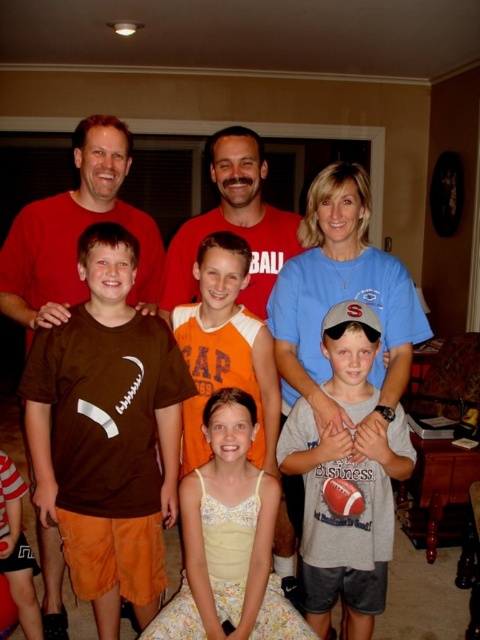
Who is taller, brown cotton t-shirt at center or yellow lace dress at center?

brown cotton t-shirt at center

Where is `brown cotton t-shirt at center`? brown cotton t-shirt at center is located at coordinates (108, 433).

Can you confirm if brown cotton t-shirt at center is taller than brown matte jersey at center?

Indeed, brown cotton t-shirt at center has a greater height compared to brown matte jersey at center.

Which is behind, point (103, 401) or point (144, 253)?

The point (144, 253) is behind.

The height and width of the screenshot is (640, 480). What do you see at coordinates (108, 433) in the screenshot?
I see `brown cotton t-shirt at center` at bounding box center [108, 433].

Where is `brown cotton t-shirt at center`? brown cotton t-shirt at center is located at coordinates (108, 433).

Does point (46, 244) come closer to viewer compared to point (271, 611)?

No, it is behind (271, 611).

Between brown matte jersey at center and yellow lace dress at center, which one appears on the left side from the viewer's perspective?

From the viewer's perspective, brown matte jersey at center appears more on the left side.

At what (x,y) coordinates should I click in order to perform the action: click on brown matte jersey at center. Please return your answer as a coordinate pair (x, y). This screenshot has height=640, width=480. Looking at the image, I should click on (249, 212).